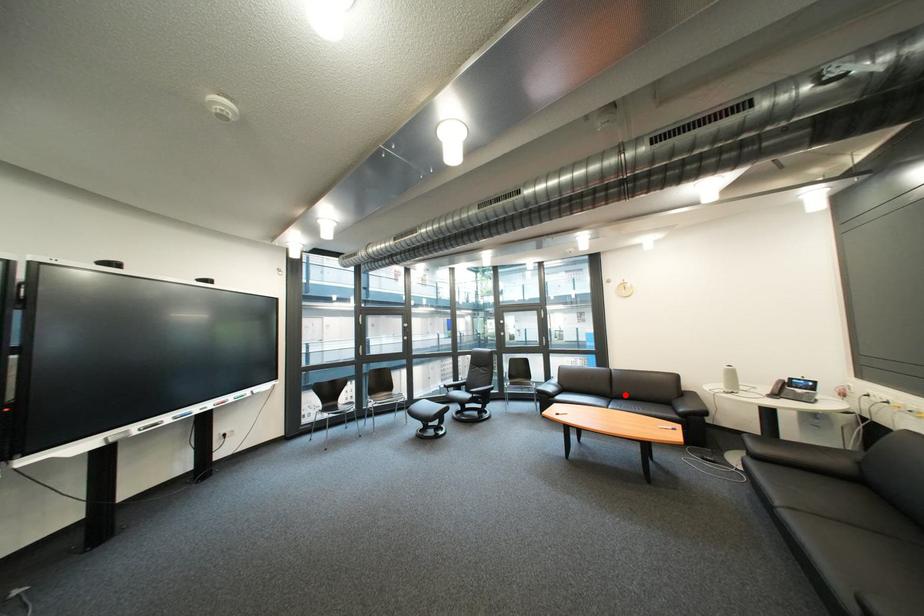
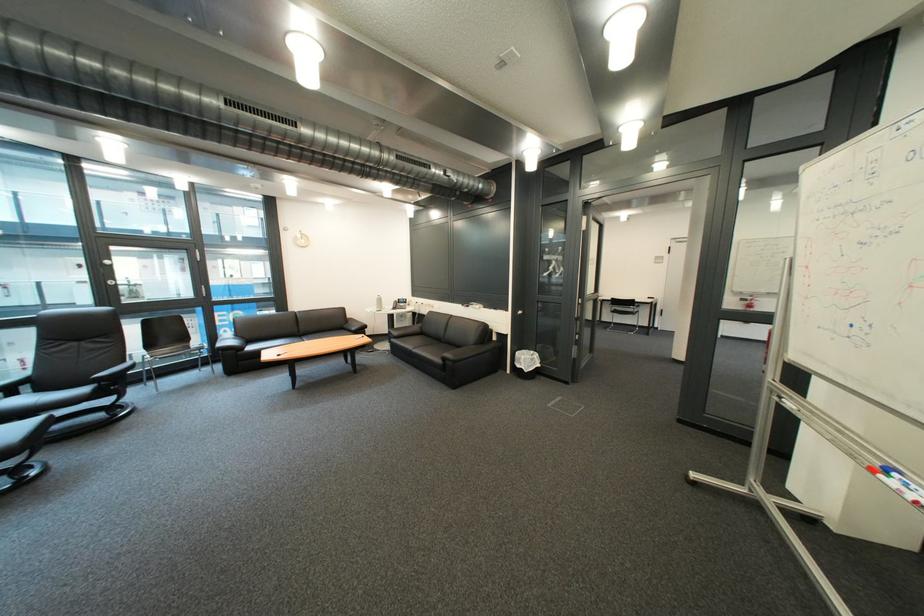
Question: I am providing you with two images of the same scene from different viewpoints. Image1 has a red point marked. In image2, the corresponding 3D location appears at what relative position? Reply with the corresponding letter.

Choices:
 (A) Closer
 (B) Farther

Answer: (A)